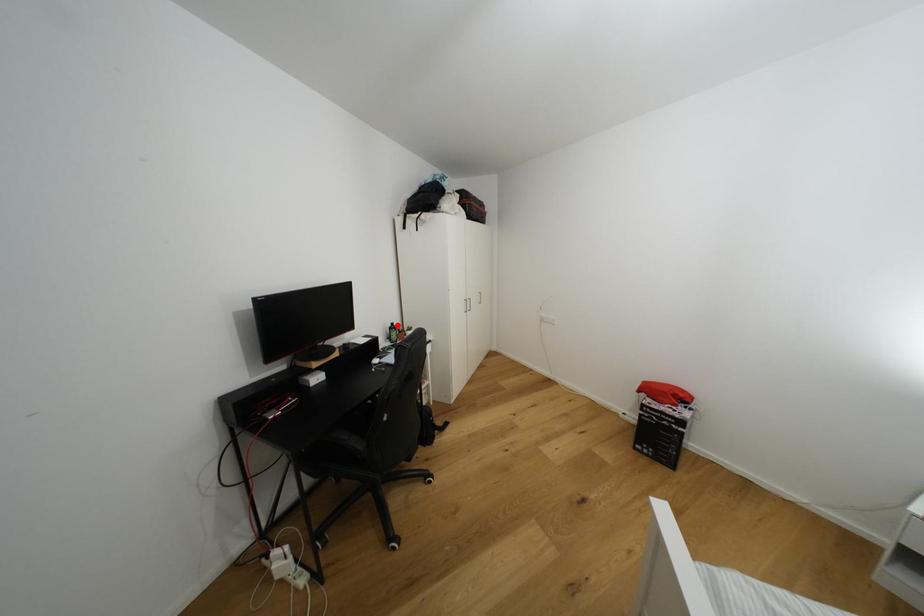
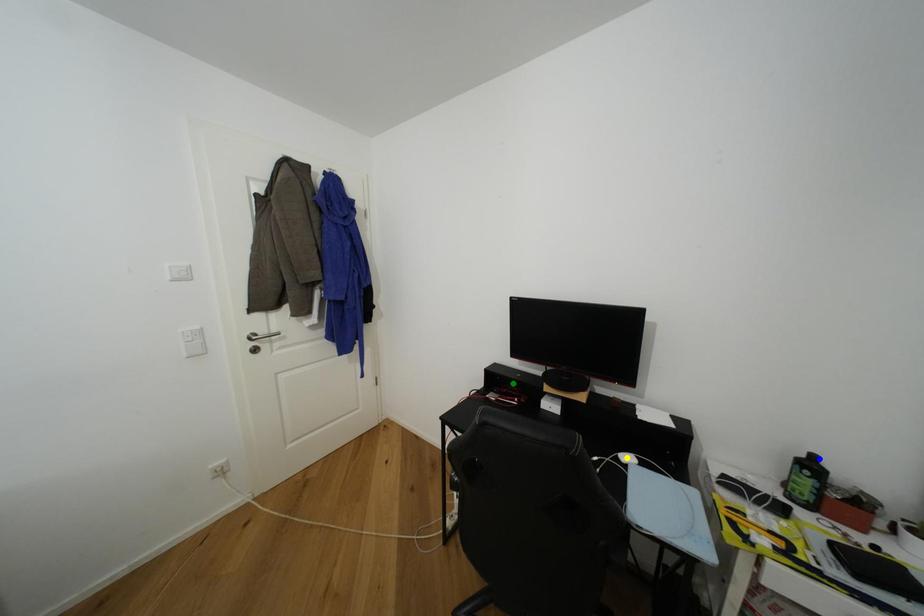
Question: I am providing you with two images of the same scene from different viewpoints. A red point is marked on the first image. You are given multiple points on the second image. Which point in image 2 represents the same 3d spot as the red point in image 1?

Choices:
 (A) yellow point
 (B) green point
 (C) blue point

Answer: (C)